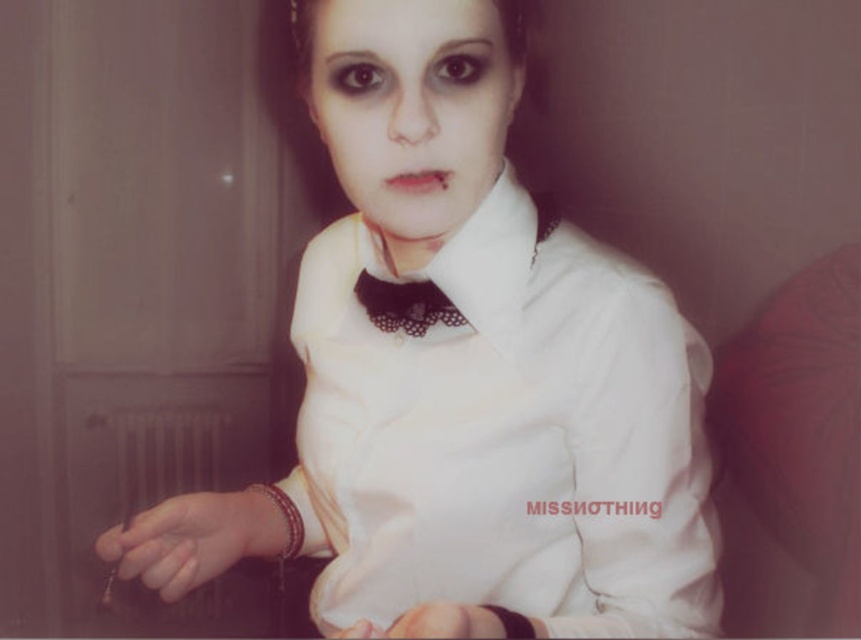
Between black lace bow tie at center and satin-like brown bracelet at lower center, which one is positioned lower?

satin-like brown bracelet at lower center is lower down.

I want to click on black lace bow tie at center, so click(406, 305).

You are a GUI agent. You are given a task and a screenshot of the screen. Output one action in this format:
    pyautogui.click(x=<x>, y=<y>)
    Task: Click on the black lace bow tie at center
    
    Given the screenshot: What is the action you would take?
    pyautogui.click(x=406, y=305)

Does white satin shirt at center have a smaller size compared to matte white face at center?

No.

Between point (354, 497) and point (387, 3), which one is positioned behind?

Positioned behind is point (354, 497).

At what (x,y) coordinates should I click in order to perform the action: click on white satin shirt at center. Please return your answer as a coordinate pair (x, y). This screenshot has width=861, height=640. Looking at the image, I should click on (505, 435).

Can you confirm if white satin shirt at center is smaller than satin-like brown bracelet at lower center?

Incorrect, white satin shirt at center is not smaller in size than satin-like brown bracelet at lower center.

Is point (624, 515) behind point (518, 632)?

Yes.

Between point (344, 416) and point (494, 611), which one is positioned in front?

Positioned in front is point (494, 611).

This screenshot has height=640, width=861. In order to click on white satin shirt at center in this screenshot , I will do [505, 435].